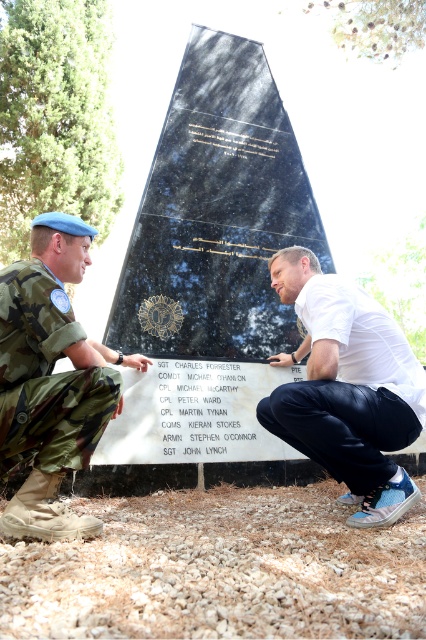
Question: Is camo uniform at left below white matte shirt at center?

Choices:
 (A) yes
 (B) no

Answer: (B)

Question: Does camo uniform at left appear over white matte shirt at center?

Choices:
 (A) yes
 (B) no

Answer: (A)

Question: Which object appears closest to the camera in this image?

Choices:
 (A) camo uniform at left
 (B) white matte shirt at center

Answer: (A)

Question: Does camo uniform at left have a smaller size compared to white matte shirt at center?

Choices:
 (A) no
 (B) yes

Answer: (B)

Question: Which point appears closest to the camera in this image?

Choices:
 (A) (380, 397)
 (B) (5, 396)

Answer: (B)